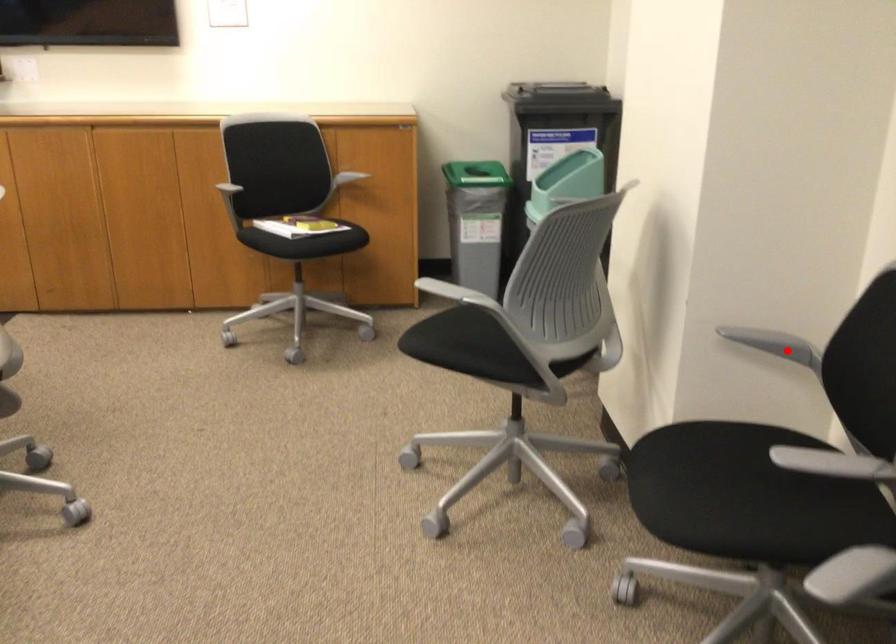
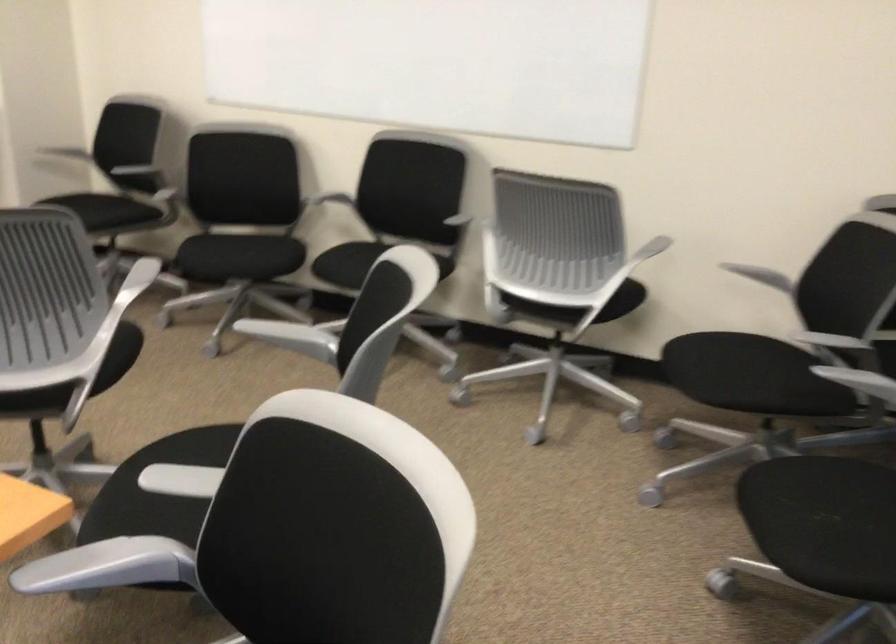
The point at the highlighted location is marked in the first image. Where is the corresponding point in the second image?

(83, 149)